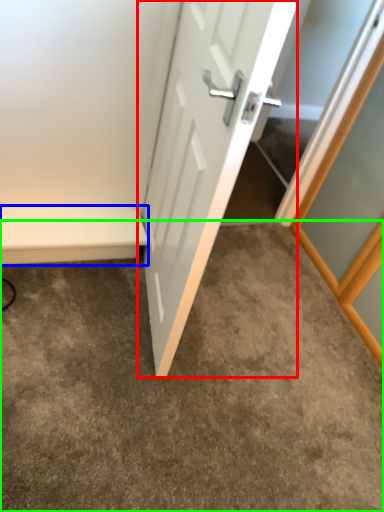
Question: Based on their relative distances, which object is nearer to door (highlighted by a red box)? Choose from balustrade (highlighted by a blue box) and concrete (highlighted by a green box).

Choices:
 (A) balustrade
 (B) concrete

Answer: (A)